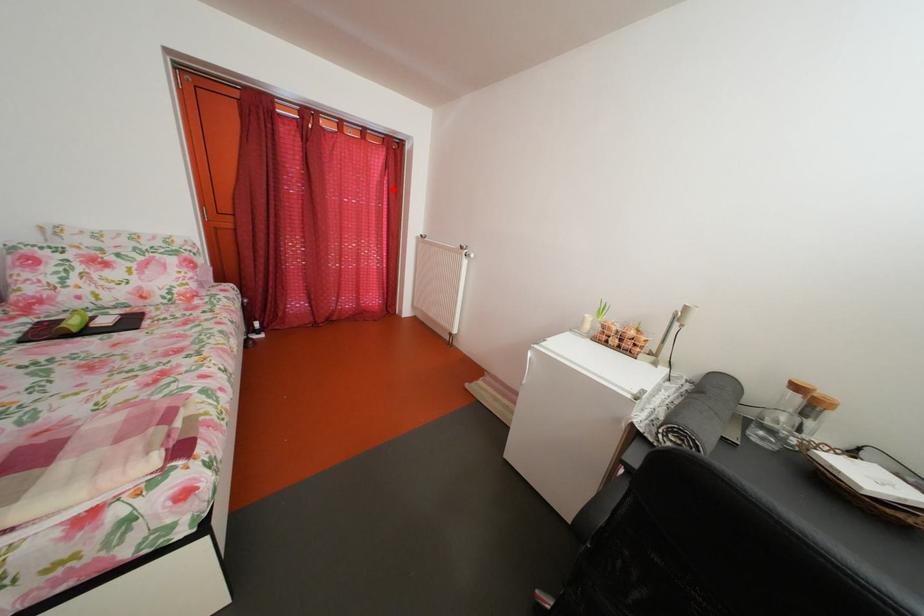
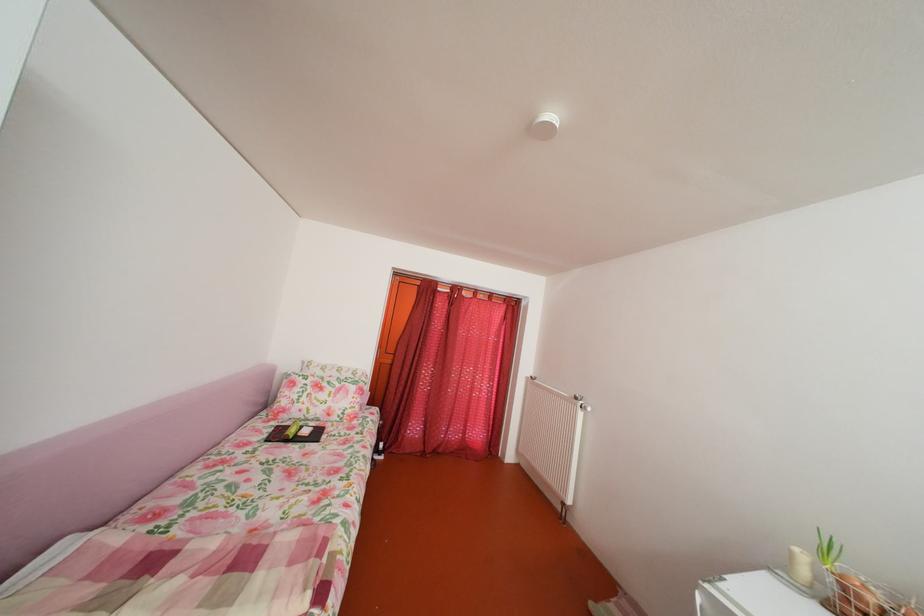
Question: I am providing you with two images of the same scene from different viewpoints. Image1 has a red point marked. In image2, the corresponding 3D location appears at what relative position? Reply with the corresponding letter.

Choices:
 (A) Closer
 (B) Farther

Answer: (B)